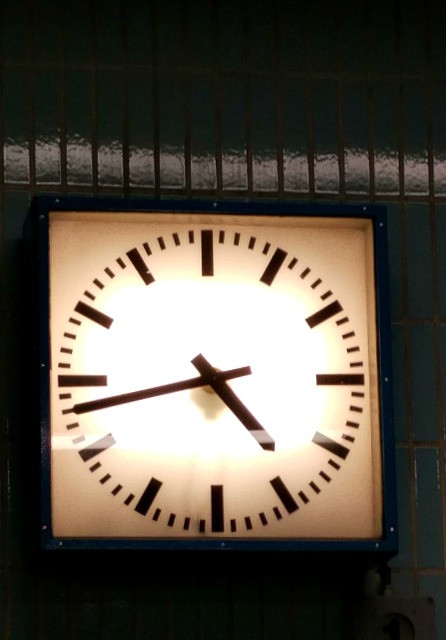
Where is `wall`? The height and width of the screenshot is (640, 446). wall is located at coordinates (422, 481).